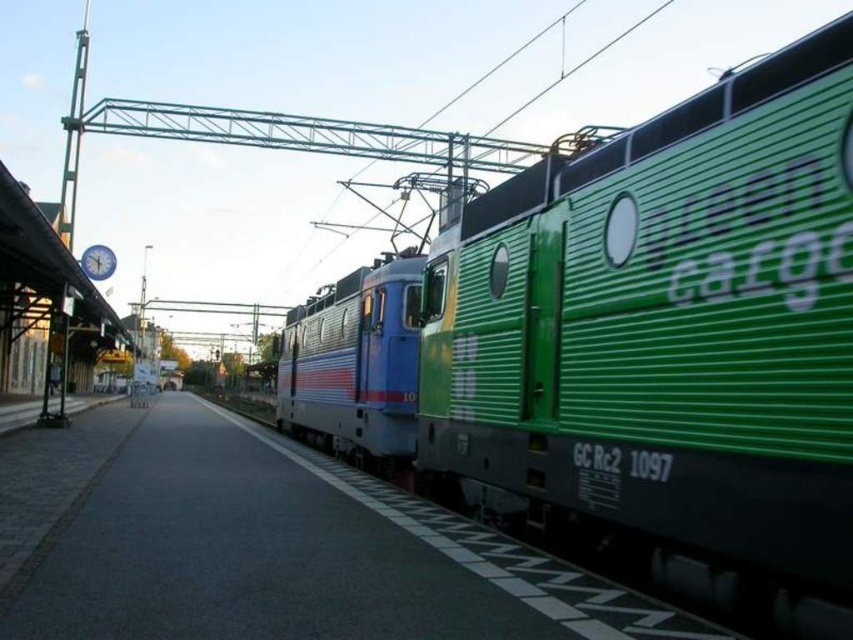
Does green corrugated train at right appear on the left side of metallic blue train car at center?

In fact, green corrugated train at right is to the right of metallic blue train car at center.

Who is more forward, (376, 404) or (376, 401)?

Point (376, 404) is in front.

I want to click on green corrugated train at right, so click(x=630, y=344).

Identify the location of green corrugated train at right. (630, 344).